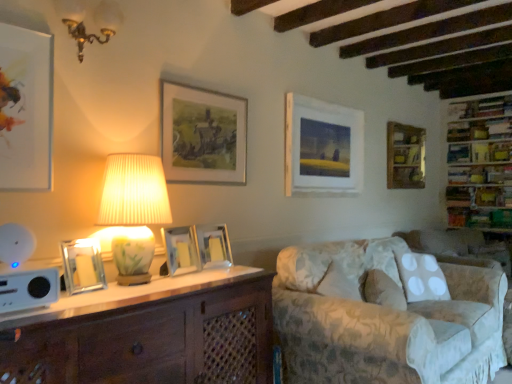
Locate an element on the screen. The height and width of the screenshot is (384, 512). vacant area that lies in front of transparent glass picture frame at left, which is counted as the 6th picture frame, starting from the back is located at coordinates (79, 298).